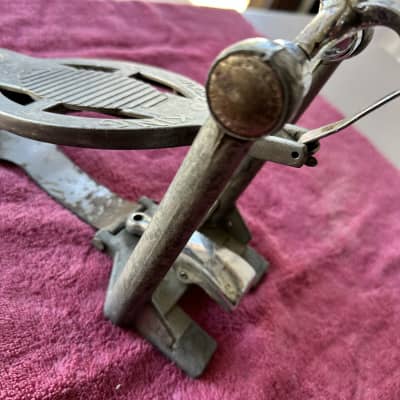
Image resolution: width=400 pixels, height=400 pixels. What are the coordinates of `table` in the screenshot? It's located at (282, 27), (392, 129), (358, 82).